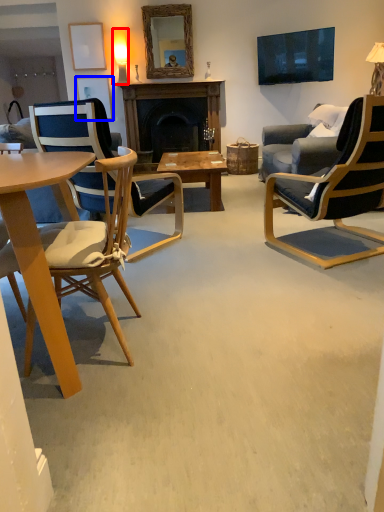
Question: Which object appears closest to the camera in this image, lamp (highlighted by a red box) or picture frame (highlighted by a blue box)?

Choices:
 (A) lamp
 (B) picture frame

Answer: (A)